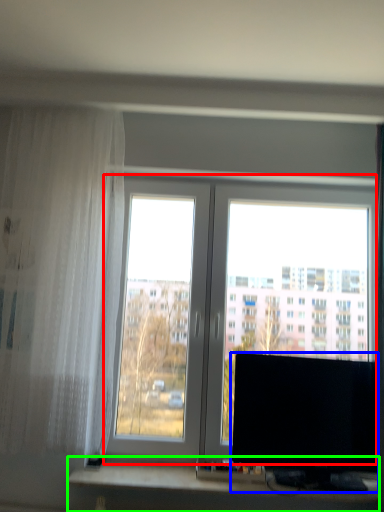
Question: Estimate the real-world distances between objects in this image. Which object is closer to window (highlighted by a red box), computer monitor (highlighted by a blue box) or computer desk (highlighted by a green box)?

Choices:
 (A) computer monitor
 (B) computer desk

Answer: (A)